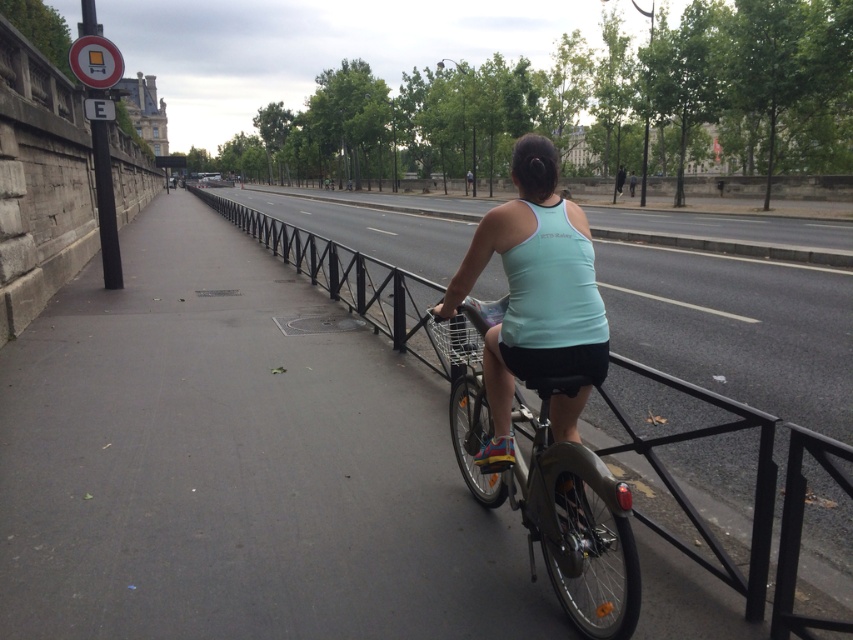
You are a pedestrian standing at the edge of the pathway. You want to cross to the other side but need to ensure there is enough space between the black metal rail at center and the light blue fabric tank top at center. What is the minimum distance you should maintain to safely pass?

The minimum distance you should maintain is 7.43 meters between the black metal rail at center and the light blue fabric tank top at center to safely pass.

From the picture: You are a cyclist on the pathway and want to reach the point at coordinates (772,500). You are currently at point (502,214). Which direction should you head to reach your destination?

The point at (772,500) is in front of point (502,214). So you should head forward along the pathway to reach your destination.

You are a pedestrian walking on the pathway and want to cross to the other side. The black metal rail at center and the light blue fabric tank top at center are in your way. Which object should you move around to the right to avoid the rail?

You should move around the light blue fabric tank top at center to the right since the black metal rail at center is to the left of it, meaning the cyclist is between you and the rail. By moving around the cyclist to the right, you can safely navigate past the rail.